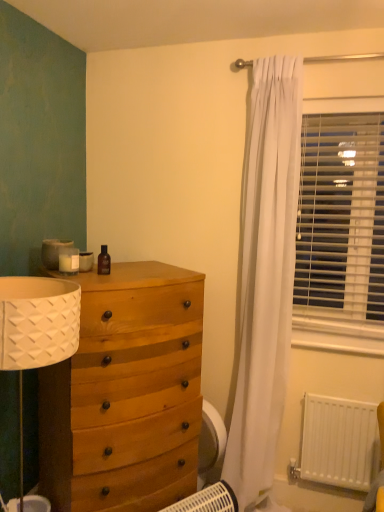
Question: Is white matte radiator at lower right facing towards white plastic heater at lower center?

Choices:
 (A) yes
 (B) no

Answer: (B)

Question: Is white matte radiator at lower right facing away from white plastic heater at lower center?

Choices:
 (A) yes
 (B) no

Answer: (B)

Question: Is white matte radiator at lower right wider than white plastic heater at lower center?

Choices:
 (A) no
 (B) yes

Answer: (A)

Question: Can you confirm if white matte radiator at lower right is thinner than white plastic heater at lower center?

Choices:
 (A) yes
 (B) no

Answer: (A)

Question: Is white matte radiator at lower right shorter than white plastic heater at lower center?

Choices:
 (A) yes
 (B) no

Answer: (B)

Question: Looking at the image, does white matte radiator at lower right seem bigger or smaller compared to wooden chest of drawers at left?

Choices:
 (A) big
 (B) small

Answer: (B)

Question: Does point (357, 454) appear closer or farther from the camera than point (196, 345)?

Choices:
 (A) farther
 (B) closer

Answer: (A)

Question: From the image's perspective, is white matte radiator at lower right located above or below wooden chest of drawers at left?

Choices:
 (A) above
 (B) below

Answer: (B)

Question: Considering the positions of white matte radiator at lower right and wooden chest of drawers at left in the image, is white matte radiator at lower right taller or shorter than wooden chest of drawers at left?

Choices:
 (A) tall
 (B) short

Answer: (B)

Question: Is white plastic blinds at right in front of or behind wooden chest of drawers at left in the image?

Choices:
 (A) behind
 (B) front

Answer: (A)

Question: Considering the positions of point (327, 132) and point (107, 330), is point (327, 132) closer or farther from the camera than point (107, 330)?

Choices:
 (A) closer
 (B) farther

Answer: (B)

Question: From a real-world perspective, is white plastic blinds at right positioned above or below wooden chest of drawers at left?

Choices:
 (A) below
 (B) above

Answer: (B)

Question: Considering the positions of white plastic blinds at right and wooden chest of drawers at left in the image, is white plastic blinds at right wider or thinner than wooden chest of drawers at left?

Choices:
 (A) wide
 (B) thin

Answer: (B)

Question: Is white plastic heater at lower center spatially inside white matte radiator at lower right, or outside of it?

Choices:
 (A) inside
 (B) outside

Answer: (B)

Question: From the image's perspective, is white plastic heater at lower center above or below white matte radiator at lower right?

Choices:
 (A) above
 (B) below

Answer: (B)